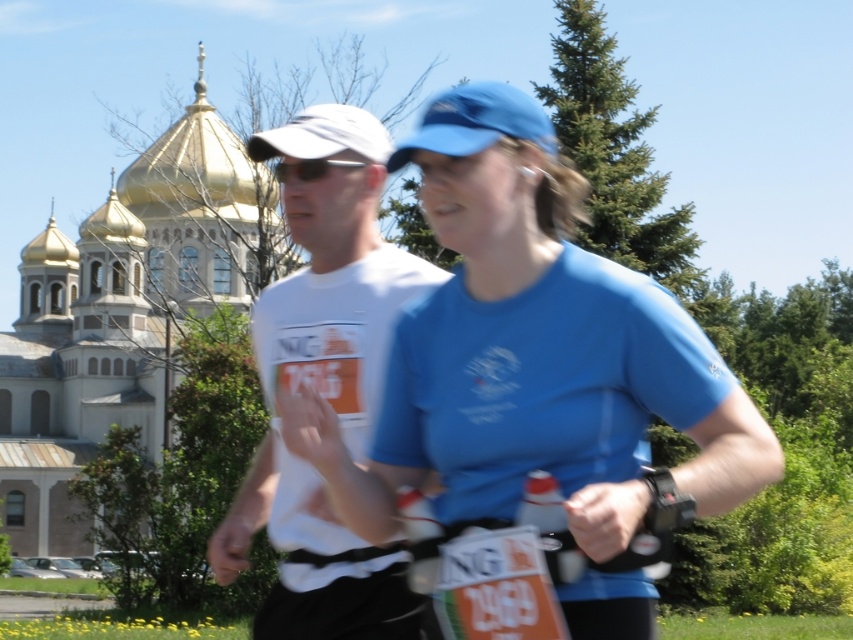
Looking at this image, who is taller, blue fabric shirt at center or white matte t-shirt at center?

Standing taller between the two is white matte t-shirt at center.

Does point (590, 289) come closer to viewer compared to point (363, 458)?

That is True.

At what (x,y) coordinates should I click in order to perform the action: click on blue fabric shirt at center. Please return your answer as a coordinate pair (x, y). The height and width of the screenshot is (640, 853). Looking at the image, I should click on (537, 372).

Can you confirm if blue fabric shirt at center is bigger than black plastic sunglasses at center?

Yes, blue fabric shirt at center is bigger than black plastic sunglasses at center.

Is blue fabric shirt at center taller than black plastic sunglasses at center?

Yes, blue fabric shirt at center is taller than black plastic sunglasses at center.

Image resolution: width=853 pixels, height=640 pixels. In order to click on blue fabric shirt at center in this screenshot , I will do `click(537, 372)`.

Does white matte t-shirt at center have a lesser height compared to black plastic sunglasses at center?

No, white matte t-shirt at center is not shorter than black plastic sunglasses at center.

Can you confirm if white matte t-shirt at center is thinner than black plastic sunglasses at center?

Incorrect, white matte t-shirt at center's width is not less than black plastic sunglasses at center's.

Is point (373, 172) positioned after point (357, 166)?

Yes, point (373, 172) is farther from viewer.

Where is `white matte t-shirt at center`? The image size is (853, 640). white matte t-shirt at center is located at coordinates (334, 269).